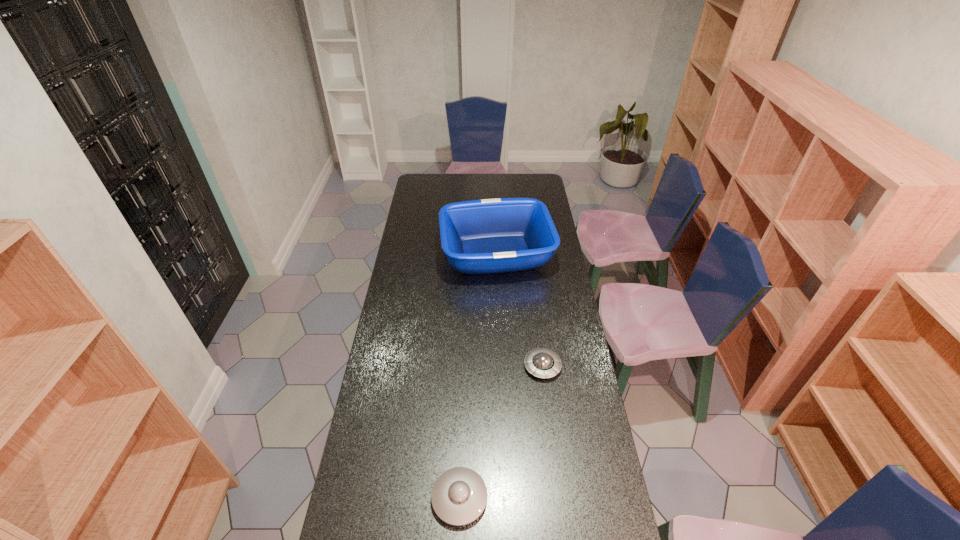
Where is `tray`? tray is located at coordinates (486, 236).

I want to click on the farthest object, so click(x=486, y=236).

Identify the location of the second nearest object. The height and width of the screenshot is (540, 960). (x=543, y=363).

Identify the location of the farther saucer. The width and height of the screenshot is (960, 540). (543, 363).

Identify the location of the nearest object. The height and width of the screenshot is (540, 960). (459, 496).

Locate an element on the screen. The image size is (960, 540). the left saucer is located at coordinates (459, 496).

At what (x,y) coordinates should I click in order to perform the action: click on vacant space located on the back of the tallest object. Please return your answer as a coordinate pair (x, y). The width and height of the screenshot is (960, 540). Looking at the image, I should click on (494, 211).

Find the location of a particular element. vacant space situated on the left of the farther saucer is located at coordinates (464, 367).

Find the location of `vacant region located on the back of the nearest object`. vacant region located on the back of the nearest object is located at coordinates (463, 394).

The image size is (960, 540). In order to click on tray present at the right edge in this screenshot , I will do `click(486, 236)`.